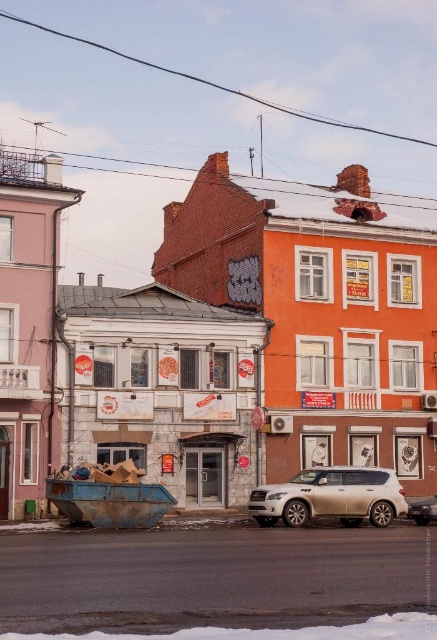
Can you confirm if satin white suv at center is positioned above shiny silver suv at center?

Correct, satin white suv at center is located above shiny silver suv at center.

Can you confirm if satin white suv at center is positioned below shiny silver suv at center?

Incorrect, satin white suv at center is not positioned below shiny silver suv at center.

I want to click on satin white suv at center, so click(x=330, y=497).

Does white powdery snow at lower center appear on the right side of shiny silver suv at center?

In fact, white powdery snow at lower center is to the left of shiny silver suv at center.

Who is positioned more to the left, white powdery snow at lower center or shiny silver suv at center?

white powdery snow at lower center is more to the left.

Is point (55, 637) closer to viewer compared to point (418, 506)?

Yes, it is in front of point (418, 506).

What are the coordinates of `white powdery snow at lower center` in the screenshot? It's located at (273, 630).

In the scene shown: Does rusty metal boat at lower left have a lesser width compared to white powdery snow at lower center?

Yes, rusty metal boat at lower left is thinner than white powdery snow at lower center.

Which of these two, rusty metal boat at lower left or white powdery snow at lower center, stands shorter?

With less height is white powdery snow at lower center.

Locate an element on the screen. rusty metal boat at lower left is located at coordinates (108, 497).

This screenshot has width=437, height=640. I want to click on rusty metal boat at lower left, so click(108, 497).